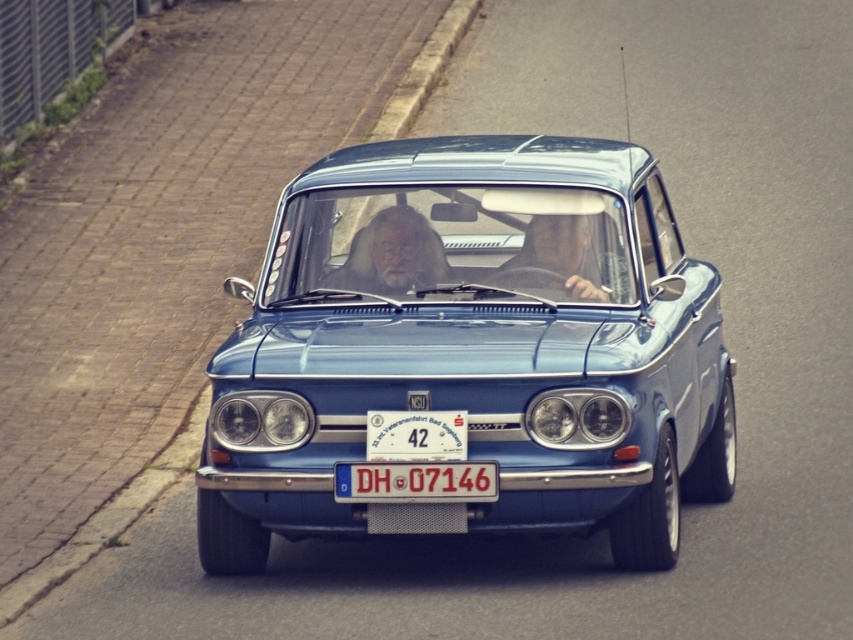
You are standing next to a camera that is 27.85 feet away from the metallic blue car at center. If you want to take a photo of the car using a standard camera with a 50mm lens, will you be able to capture the entire car in the frame without moving closer or farther away?

The metallic blue car at center and camera are 27.85 feet apart from each other. With a standard 50mm lens, the field of view at that distance should allow capturing the entire car in the frame, assuming the camera is positioned appropriately to frame the car correctly.

You are a photographer trying to capture a closeup of the driver and passenger inside the vintage NSU car. You notice the gray hair and beard at center and the smooth leather face at center. Which of these two features has a wider appearance?

The gray hair and beard at center has a larger width than the smooth leather face at center.